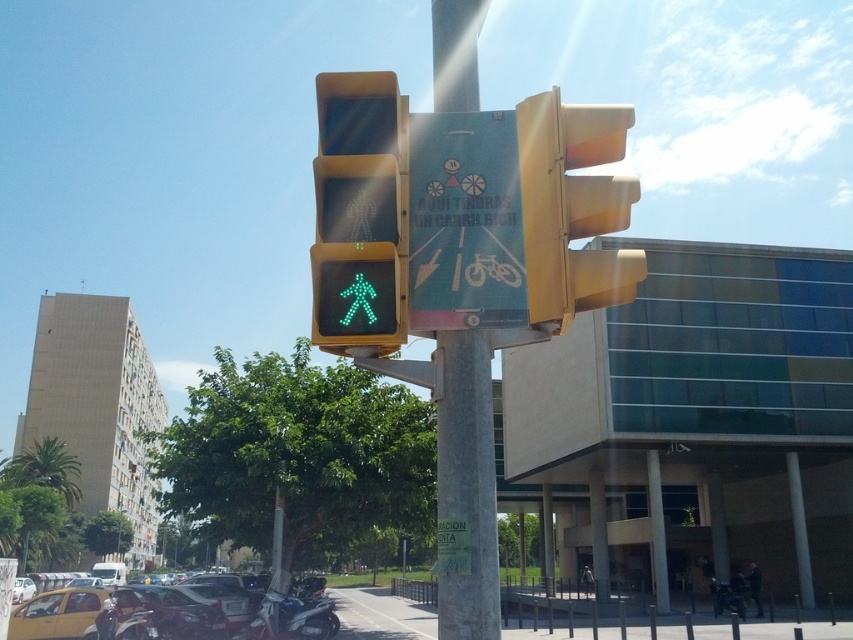
Which is more to the right, metallic yellow traffic light at upper right or yellow matte taxi at lower left?

metallic yellow traffic light at upper right

Is metallic yellow traffic light at upper right positioned before yellow matte taxi at lower left?

Yes.

Is point (607, 276) closer to viewer compared to point (123, 636)?

Yes, point (607, 276) is closer to viewer.

Where is `metallic yellow traffic light at upper right`? The width and height of the screenshot is (853, 640). metallic yellow traffic light at upper right is located at coordinates (573, 208).

Can you confirm if metallic pole at center is thinner than green led pedestrian at center?

Yes.

Is the position of metallic pole at center less distant than that of green led pedestrian at center?

Yes, it is in front of green led pedestrian at center.

Is point (451, 445) closer to viewer compared to point (339, 209)?

No, it is behind (339, 209).

You are a GUI agent. You are given a task and a screenshot of the screen. Output one action in this format:
    pyautogui.click(x=<x>, y=<y>)
    Task: Click on the metallic pole at center
    
    Given the screenshot: What is the action you would take?
    pyautogui.click(x=466, y=488)

Can you confirm if metallic pole at center is taller than yellow matte car at lower left?

Yes, metallic pole at center is taller than yellow matte car at lower left.

Where is `metallic pole at center`? This screenshot has width=853, height=640. metallic pole at center is located at coordinates (466, 488).